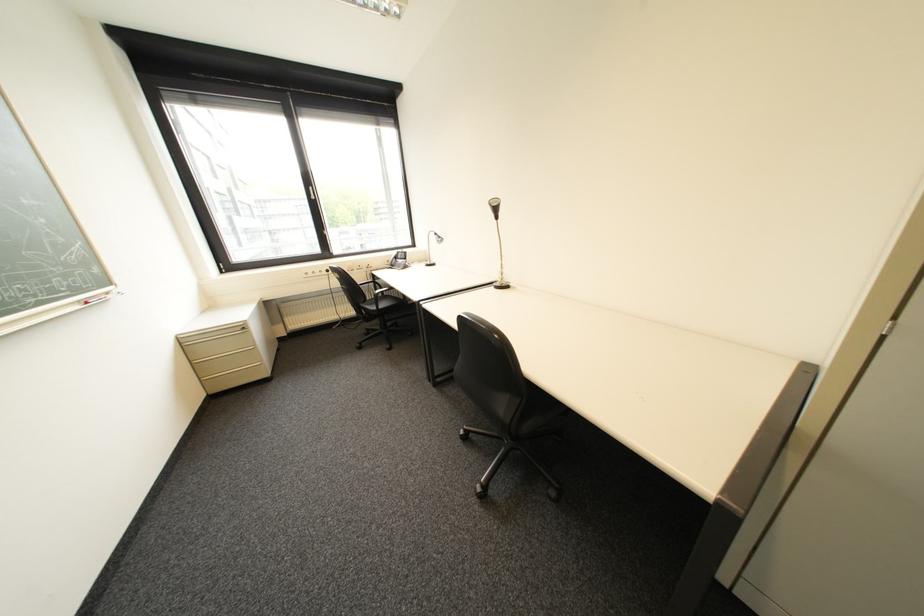
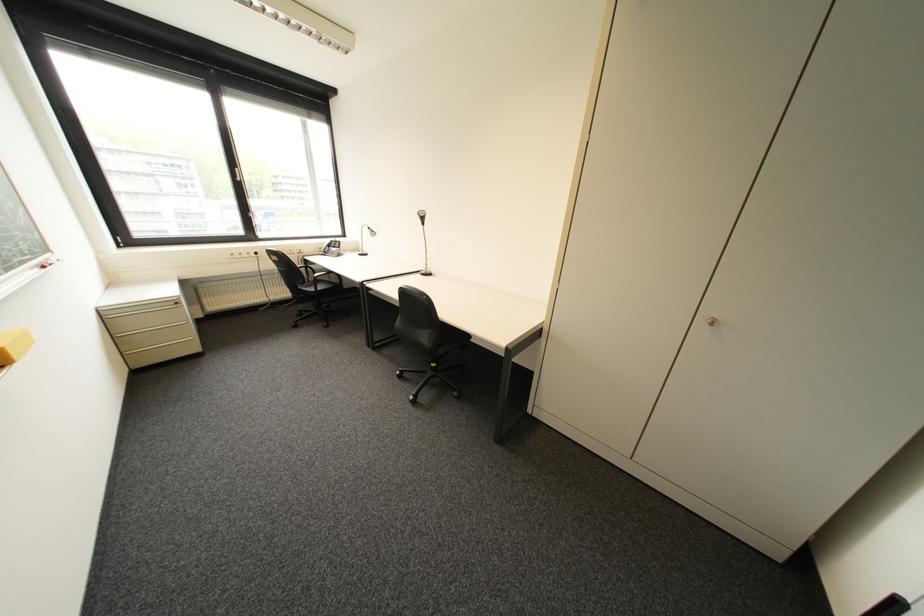
Locate, in the second image, the point that corresponds to [505,285] in the first image.

(432, 273)